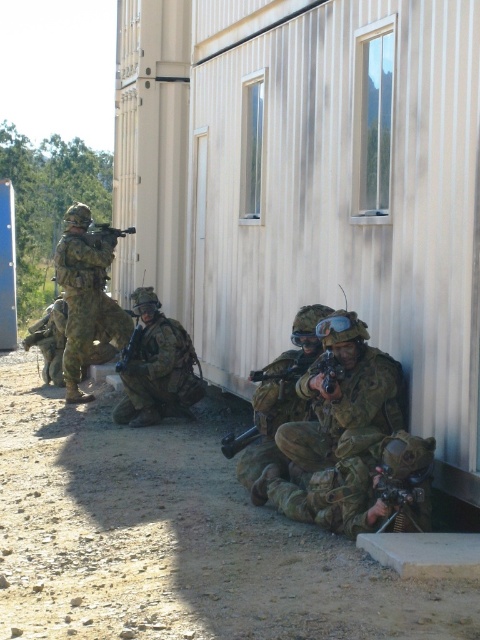
You are a soldier in the formation. You need to retrieve your matte black rifle at center but first must pick up your camouflage fabric helmet at lower right. Is the helmet below the rifle within reach without moving your position?

The camouflage fabric helmet at lower right is located below the matte black rifle at center, so yes, the soldier can reach the helmet first without moving position as it is positioned lower than the rifle.

You are a military analyst observing the soldiers in the scene. You need to determine if the camouflage fabric uniform at center can be seen over the matte black rifle at lower center when viewed from the front. Can you confirm this?

The camouflage fabric uniform at center is much taller than the matte black rifle at lower center, so yes, the uniform can be seen over the rifle when viewed from the front.